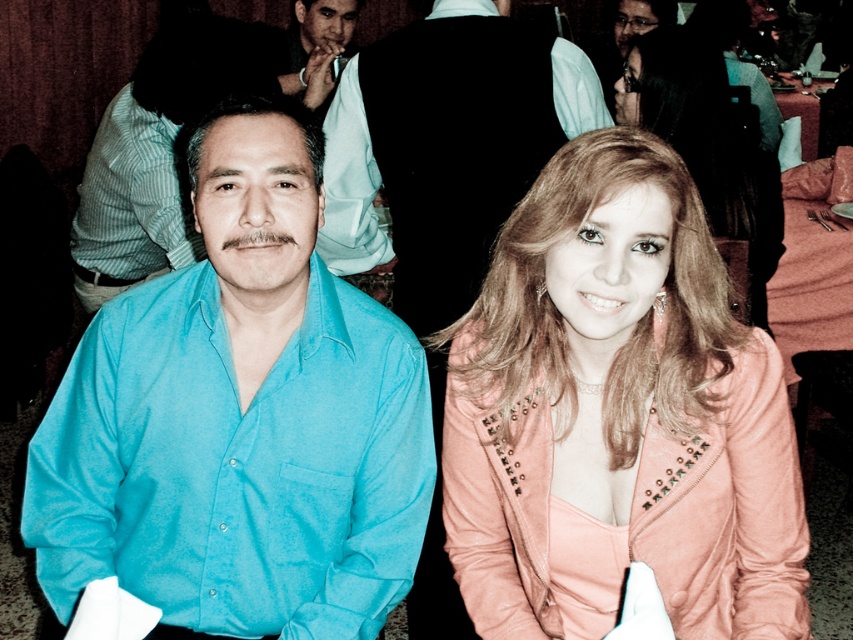
Between peach suede jacket at right and shiny pink jacket at center, which one is positioned lower?

peach suede jacket at right is lower down.

Between point (729, 413) and point (753, 216), which one is positioned in front?

Point (729, 413) is in front.

Locate an element on the screen. peach suede jacket at right is located at coordinates (618, 413).

Is peach suede jacket at right bigger than teal smooth shirt at left?

Incorrect, peach suede jacket at right is not larger than teal smooth shirt at left.

Consider the image. Is peach suede jacket at right thinner than teal smooth shirt at left?

Indeed, peach suede jacket at right has a lesser width compared to teal smooth shirt at left.

The height and width of the screenshot is (640, 853). Identify the location of peach suede jacket at right. 618,413.

Which is below, peach suede jacket at right or black satin vest at upper center?

peach suede jacket at right is lower down.

Where is `peach suede jacket at right`? peach suede jacket at right is located at coordinates (618, 413).